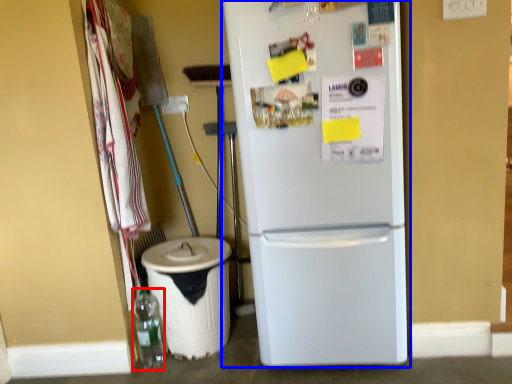
Question: Which point is further to the camera, bottle (highlighted by a red box) or refrigerator (highlighted by a blue box)?

Choices:
 (A) bottle
 (B) refrigerator

Answer: (A)